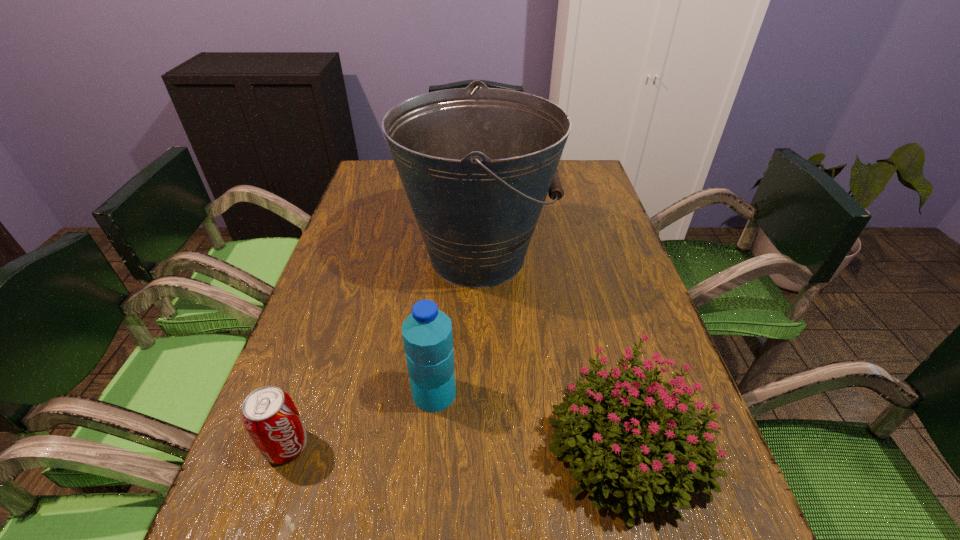
You are a GUI agent. You are given a task and a screenshot of the screen. Output one action in this format:
    pyautogui.click(x=<x>, y=<y>)
    Task: Click on the tallest object
    
    Given the screenshot: What is the action you would take?
    pyautogui.click(x=476, y=164)

This screenshot has height=540, width=960. Find the location of `bucket`. bucket is located at coordinates (476, 164).

The width and height of the screenshot is (960, 540). I want to click on water bottle, so click(427, 335).

Identify the location of bouquet. Image resolution: width=960 pixels, height=540 pixels. (654, 472).

In order to click on the leftmost object in this screenshot , I will do `click(269, 415)`.

You are a GUI agent. You are given a task and a screenshot of the screen. Output one action in this format:
    pyautogui.click(x=<x>, y=<y>)
    Task: Click on the soda
    
    Given the screenshot: What is the action you would take?
    pyautogui.click(x=269, y=415)

You are a GUI agent. You are given a task and a screenshot of the screen. Output one action in this format:
    pyautogui.click(x=<x>, y=<y>)
    Task: Click on the free space located with the handle on opposite sides of the tallest object
    The height and width of the screenshot is (540, 960).
    Given the screenshot: What is the action you would take?
    pyautogui.click(x=622, y=256)

Find the location of `vacant space situated 0.400m on the right of the water bottle`. vacant space situated 0.400m on the right of the water bottle is located at coordinates (669, 393).

Find the location of a particular element. Image resolution: width=960 pixels, height=540 pixels. free space located on the back of the bouquet is located at coordinates (600, 341).

Find the location of a particular element. free spot located 0.360m on the back of the shortest object is located at coordinates (342, 288).